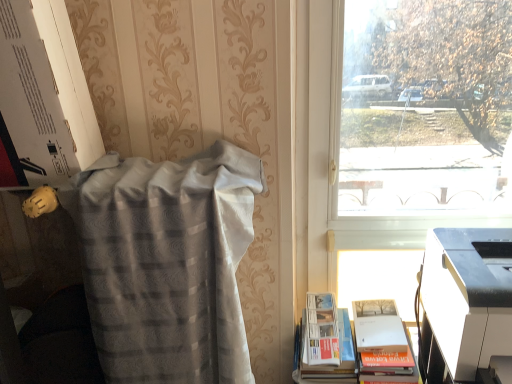
Question: Is transparent glass window at upper right smaller than silvery textured blanket at left?

Choices:
 (A) no
 (B) yes

Answer: (B)

Question: From the image's perspective, is transparent glass window at upper right below silvery textured blanket at left?

Choices:
 (A) yes
 (B) no

Answer: (B)

Question: Is silvery textured blanket at left inside transparent glass window at upper right?

Choices:
 (A) yes
 (B) no

Answer: (B)

Question: From the image's perspective, is transparent glass window at upper right located above silvery textured blanket at left?

Choices:
 (A) yes
 (B) no

Answer: (A)

Question: Is transparent glass window at upper right positioned behind silvery textured blanket at left?

Choices:
 (A) no
 (B) yes

Answer: (B)

Question: From the image's perspective, relative to silvery textured blanket at left, is transparent glass window at upper right above or below?

Choices:
 (A) below
 (B) above

Answer: (B)

Question: In the image, is transparent glass window at upper right positioned in front of or behind silvery textured blanket at left?

Choices:
 (A) behind
 (B) front

Answer: (A)

Question: Visually, is transparent glass window at upper right positioned to the left or to the right of silvery textured blanket at left?

Choices:
 (A) left
 (B) right

Answer: (B)

Question: In terms of width, does transparent glass window at upper right look wider or thinner when compared to silvery textured blanket at left?

Choices:
 (A) thin
 (B) wide

Answer: (A)

Question: Considering the positions of white plastic printer at lower right and white paperback book at lower right in the image, is white plastic printer at lower right bigger or smaller than white paperback book at lower right?

Choices:
 (A) big
 (B) small

Answer: (B)

Question: Considering their positions, is white plastic printer at lower right located in front of or behind white paperback book at lower right?

Choices:
 (A) behind
 (B) front

Answer: (B)

Question: Based on their positions, is white plastic printer at lower right located to the left or right of white paperback book at lower right?

Choices:
 (A) right
 (B) left

Answer: (A)

Question: Is point (437, 311) positioned closer to the camera than point (410, 380)?

Choices:
 (A) closer
 (B) farther

Answer: (A)

Question: From a real-world perspective, relative to transparent glass window at upper right, is white plastic printer at lower right vertically above or below?

Choices:
 (A) below
 (B) above

Answer: (A)

Question: Considering the positions of white plastic printer at lower right and transparent glass window at upper right in the image, is white plastic printer at lower right taller or shorter than transparent glass window at upper right?

Choices:
 (A) tall
 (B) short

Answer: (B)